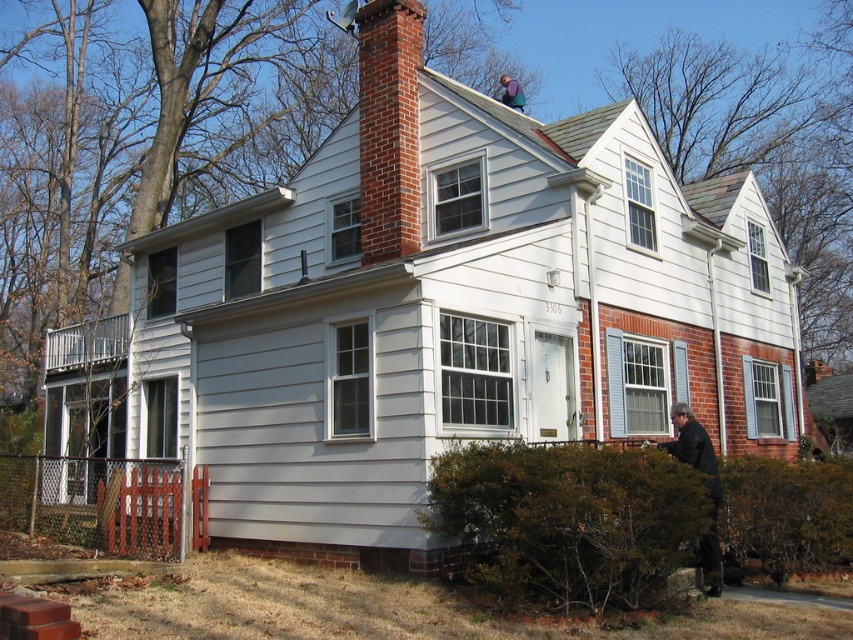
Who is lower down, brick chimney at center or blue denim jacket at upper center?

brick chimney at center is below.

Between brick chimney at center and blue denim jacket at upper center, which one has less height?

With less height is brick chimney at center.

I want to click on brick chimney at center, so click(x=389, y=128).

The width and height of the screenshot is (853, 640). I want to click on dark gray jacket at lower right, so click(706, 484).

Can you confirm if dark gray jacket at lower right is wider than blue denim jacket at upper center?

In fact, dark gray jacket at lower right might be narrower than blue denim jacket at upper center.

Is point (689, 442) positioned behind point (502, 84)?

No, (689, 442) is closer to viewer.

Find the location of a particular element. This screenshot has height=640, width=853. dark gray jacket at lower right is located at coordinates (706, 484).

Is point (409, 74) positioned before point (703, 472)?

No, it is not.

Measure the distance between brick chimney at center and camera.

46.58 feet

The image size is (853, 640). I want to click on brick chimney at center, so click(389, 128).